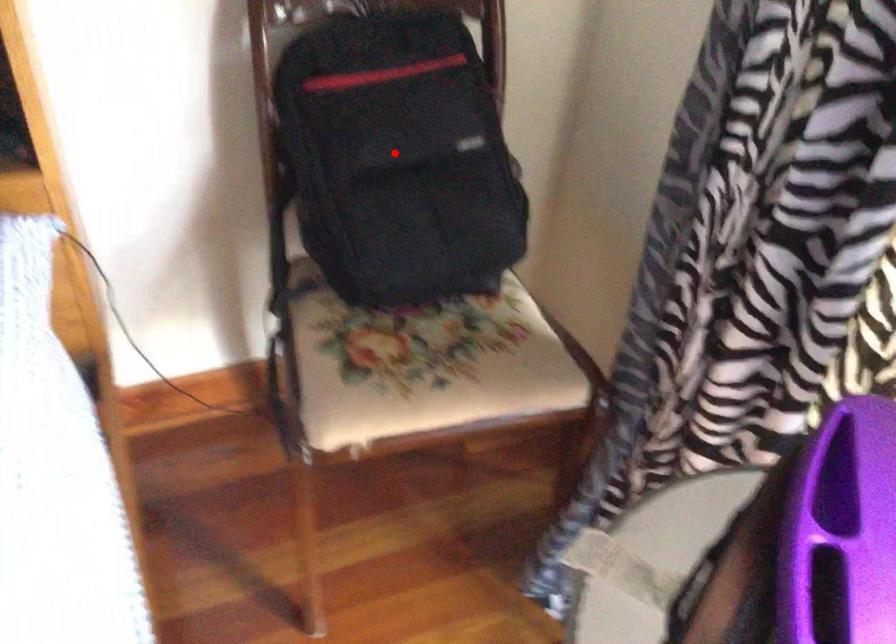
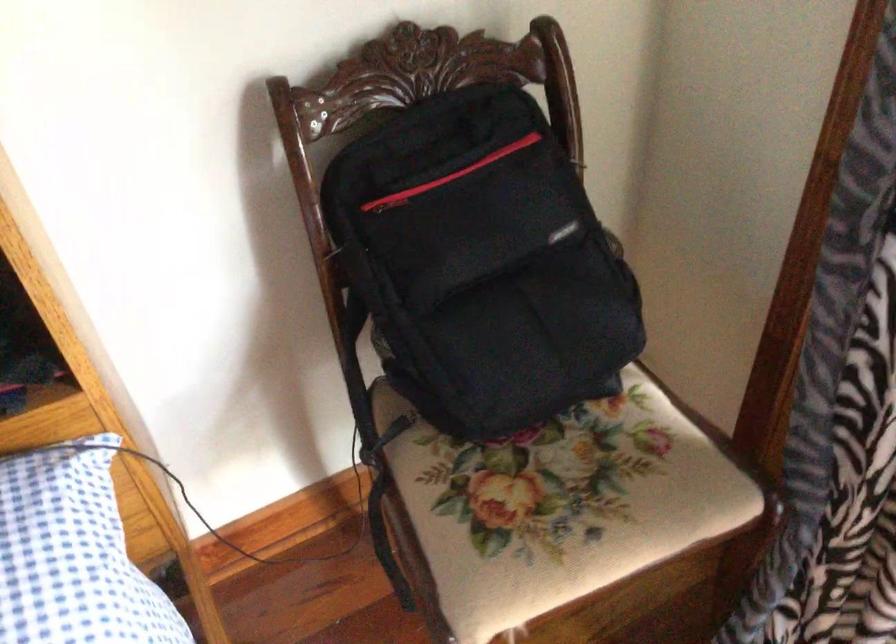
Where in the second image is the point corresponding to the highlighted location from the first image?

(480, 263)